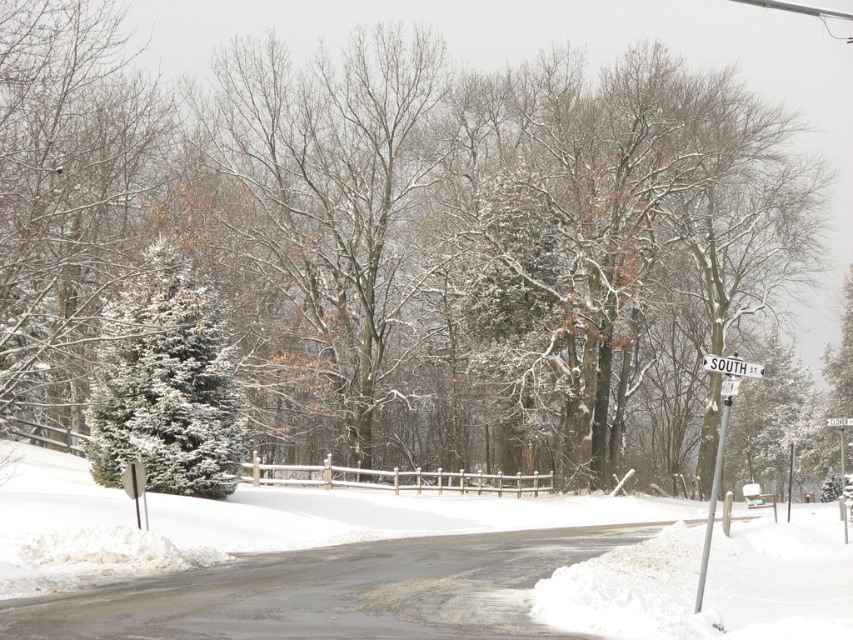
Is point (198, 385) positioned before point (706, 524)?

No.

Locate an element on the screen. The width and height of the screenshot is (853, 640). green matte evergreen tree at left is located at coordinates (166, 385).

Between point (231, 481) and point (718, 422), which one is positioned behind?

Point (718, 422)

Identify the location of green matte evergreen tree at left. This screenshot has width=853, height=640. (166, 385).

Does white plastic street sign at upper center have a smaller size compared to white plastic street sign at upper right?

Correct, white plastic street sign at upper center occupies less space than white plastic street sign at upper right.

Is white plastic street sign at upper center further to camera compared to white plastic street sign at upper right?

No, white plastic street sign at upper center is in front of white plastic street sign at upper right.

Which is in front, point (706, 369) or point (842, 417)?

Positioned in front is point (706, 369).

The width and height of the screenshot is (853, 640). I want to click on white plastic street sign at upper center, so click(730, 365).

Between point (712, 508) and point (830, 417), which one is positioned behind?

Positioned behind is point (830, 417).

Does silver metallic pole at right have a smaller size compared to white plastic street sign at upper right?

Actually, silver metallic pole at right might be larger than white plastic street sign at upper right.

Measure the distance between silver metallic pole at right and camera.

silver metallic pole at right is 10.80 meters away from camera.

This screenshot has width=853, height=640. I want to click on silver metallic pole at right, so click(712, 500).